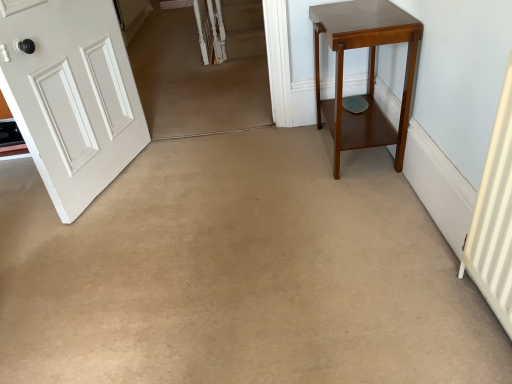
Question: Is mahogany wood side table at right shorter than white painted wood door at left?

Choices:
 (A) no
 (B) yes

Answer: (B)

Question: Is white painted wood door at left inside mahogany wood side table at right?

Choices:
 (A) yes
 (B) no

Answer: (B)

Question: Considering the relative sizes of mahogany wood side table at right and white painted wood door at left in the image provided, is mahogany wood side table at right wider than white painted wood door at left?

Choices:
 (A) yes
 (B) no

Answer: (A)

Question: From a real-world perspective, is mahogany wood side table at right under white painted wood door at left?

Choices:
 (A) yes
 (B) no

Answer: (A)

Question: From a real-world perspective, is mahogany wood side table at right physically above white painted wood door at left?

Choices:
 (A) yes
 (B) no

Answer: (B)

Question: Can you confirm if mahogany wood side table at right is taller than white painted wood door at left?

Choices:
 (A) yes
 (B) no

Answer: (B)

Question: Is white painted wood door at left located outside mahogany wood side table at right?

Choices:
 (A) no
 (B) yes

Answer: (B)

Question: Considering the relative sizes of white painted wood door at left and mahogany wood side table at right in the image provided, is white painted wood door at left smaller than mahogany wood side table at right?

Choices:
 (A) yes
 (B) no

Answer: (A)

Question: Does white painted wood door at left contain mahogany wood side table at right?

Choices:
 (A) no
 (B) yes

Answer: (A)

Question: From the image's perspective, is white painted wood door at left above mahogany wood side table at right?

Choices:
 (A) no
 (B) yes

Answer: (A)

Question: From a real-world perspective, is white painted wood door at left positioned under mahogany wood side table at right based on gravity?

Choices:
 (A) no
 (B) yes

Answer: (A)

Question: Is white painted wood door at left taller than mahogany wood side table at right?

Choices:
 (A) no
 (B) yes

Answer: (B)

Question: Is white painted wood door at left wider or thinner than mahogany wood side table at right?

Choices:
 (A) wide
 (B) thin

Answer: (B)